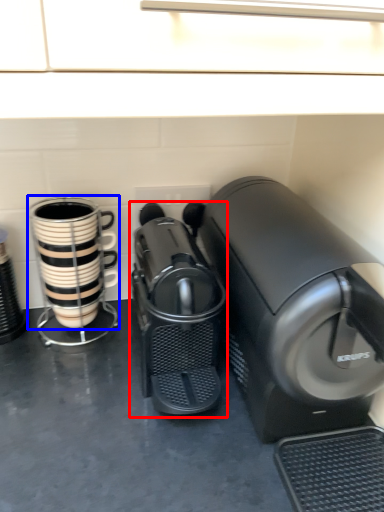
Question: Which object is further to the camera taking this photo, home appliance (highlighted by a red box) or coffee cup (highlighted by a blue box)?

Choices:
 (A) home appliance
 (B) coffee cup

Answer: (B)